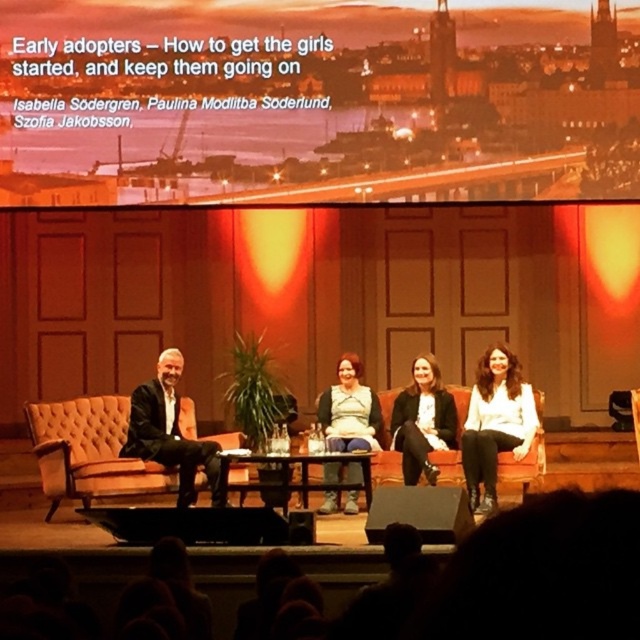
Question: Can you confirm if white matte shirt at center is bigger than white matte blazer at center?

Choices:
 (A) yes
 (B) no

Answer: (A)

Question: Which is nearer to the matte green dress at center?

Choices:
 (A) wooden at center
 (B) white matte shirt at center
 (C) white matte blazer at center
 (D) black leather jacket at left

Answer: (A)

Question: Is orange tufted leather armchair at left thinner than black leather jacket at left?

Choices:
 (A) no
 (B) yes

Answer: (A)

Question: Which is farther from the matte green dress at center?

Choices:
 (A) white matte blazer at center
 (B) wooden at center
 (C) black leather jacket at left

Answer: (C)

Question: Can you confirm if matte green dress at center is wider than white matte blazer at center?

Choices:
 (A) no
 (B) yes

Answer: (A)

Question: Among these points, which one is nearest to the camera?

Choices:
 (A) (301, 502)
 (B) (488, 481)
 (C) (166, 384)
 (D) (429, 394)

Answer: (B)